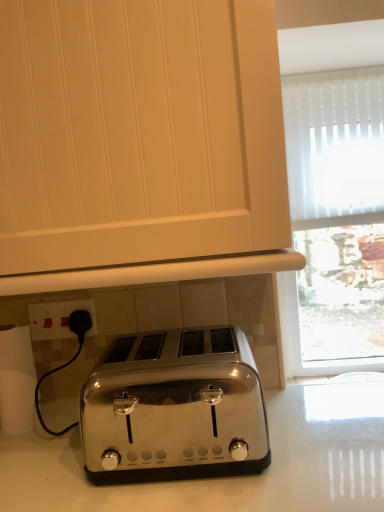
Question: Considering the relative positions of satin chrome toaster at center and white paper towel at lower left in the image provided, is satin chrome toaster at center to the right of white paper towel at lower left from the viewer's perspective?

Choices:
 (A) no
 (B) yes

Answer: (B)

Question: From the image's perspective, does satin chrome toaster at center appear lower than white paper towel at lower left?

Choices:
 (A) no
 (B) yes

Answer: (A)

Question: Can you confirm if satin chrome toaster at center is shorter than white paper towel at lower left?

Choices:
 (A) yes
 (B) no

Answer: (A)

Question: From a real-world perspective, is satin chrome toaster at center on white paper towel at lower left?

Choices:
 (A) no
 (B) yes

Answer: (A)

Question: From the image's perspective, is satin chrome toaster at center on white paper towel at lower left?

Choices:
 (A) yes
 (B) no

Answer: (A)

Question: Can we say satin chrome toaster at center lies outside white paper towel at lower left?

Choices:
 (A) no
 (B) yes

Answer: (B)

Question: Can you confirm if satin chrome toaster at lower center is wider than satin chrome toaster at center?

Choices:
 (A) yes
 (B) no

Answer: (A)

Question: Is satin chrome toaster at lower center positioned behind satin chrome toaster at center?

Choices:
 (A) yes
 (B) no

Answer: (B)

Question: From a real-world perspective, is satin chrome toaster at lower center positioned over satin chrome toaster at center based on gravity?

Choices:
 (A) yes
 (B) no

Answer: (A)

Question: Is satin chrome toaster at lower center in contact with satin chrome toaster at center?

Choices:
 (A) yes
 (B) no

Answer: (B)

Question: Does satin chrome toaster at lower center appear on the right side of satin chrome toaster at center?

Choices:
 (A) yes
 (B) no

Answer: (B)

Question: Is satin chrome toaster at lower center facing away from satin chrome toaster at center?

Choices:
 (A) no
 (B) yes

Answer: (A)

Question: Can you see satin chrome toaster at lower center touching white paper towel at lower left?

Choices:
 (A) yes
 (B) no

Answer: (B)